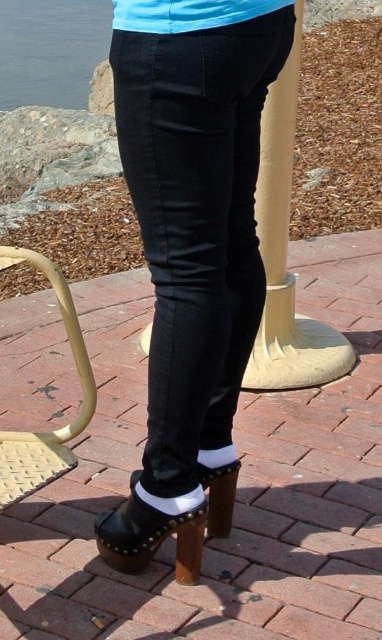
Question: Does black leather clogs at lower center have a greater width compared to beige woven stool at lower left?

Choices:
 (A) no
 (B) yes

Answer: (B)

Question: Is black leather clogs at lower center positioned before beige woven stool at lower left?

Choices:
 (A) no
 (B) yes

Answer: (B)

Question: Is black leather clogs at lower center behind beige woven stool at lower left?

Choices:
 (A) no
 (B) yes

Answer: (A)